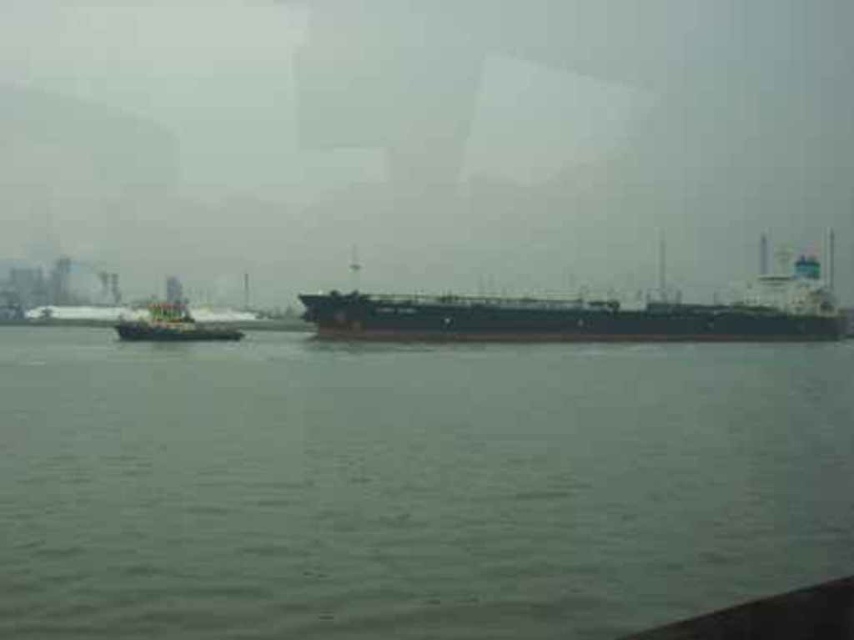
Where is `black matte cargo ship at center`? black matte cargo ship at center is located at coordinates (586, 314).

Is black matte cargo ship at center thinner than green matte tugboat at left?

Incorrect, black matte cargo ship at center's width is not less than green matte tugboat at left's.

Locate an element on the screen. black matte cargo ship at center is located at coordinates (586, 314).

Which is in front, point (186, 378) or point (612, 337)?

Point (186, 378) is in front.

This screenshot has width=854, height=640. Describe the element at coordinates (410, 484) in the screenshot. I see `gray matte water at center` at that location.

This screenshot has height=640, width=854. Find the location of `gray matte water at center`. gray matte water at center is located at coordinates (410, 484).

Does gray matte water at center have a greater height compared to green matte tugboat at left?

No, gray matte water at center is not taller than green matte tugboat at left.

Is point (150, 557) behind point (183, 337)?

That is False.

Does point (793, 556) come behind point (211, 326)?

That is False.

Where is `gray matte water at center`? The width and height of the screenshot is (854, 640). gray matte water at center is located at coordinates (410, 484).